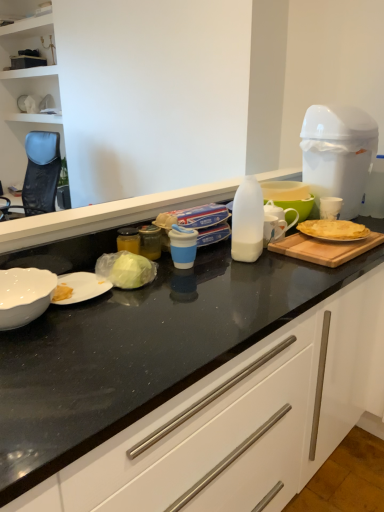
Question: Is the surface of translucent plastic milk bottle at center in direct contact with wooden cutting board at right?

Choices:
 (A) yes
 (B) no

Answer: (B)

Question: Is translucent plastic milk bottle at center positioned with its back to wooden cutting board at right?

Choices:
 (A) yes
 (B) no

Answer: (B)

Question: Is translucent plastic milk bottle at center positioned beyond the bounds of wooden cutting board at right?

Choices:
 (A) no
 (B) yes

Answer: (B)

Question: Is translucent plastic milk bottle at center thinner than wooden cutting board at right?

Choices:
 (A) yes
 (B) no

Answer: (A)

Question: Does translucent plastic milk bottle at center have a smaller size compared to wooden cutting board at right?

Choices:
 (A) yes
 (B) no

Answer: (B)

Question: Visually, is translucent plastic milk bottle at center positioned to the left or to the right of white glossy bowl at lower left?

Choices:
 (A) right
 (B) left

Answer: (A)

Question: From the image's perspective, is translucent plastic milk bottle at center positioned above or below white glossy bowl at lower left?

Choices:
 (A) above
 (B) below

Answer: (A)

Question: Is point (1, 242) positioned closer to the camera than point (36, 283)?

Choices:
 (A) farther
 (B) closer

Answer: (A)

Question: Is translucent plastic milk bottle at center inside or outside of white glossy bowl at lower left?

Choices:
 (A) inside
 (B) outside

Answer: (B)

Question: Is translucent plastic milk bottle at center inside or outside of white plastic trash can at upper right?

Choices:
 (A) outside
 (B) inside

Answer: (A)

Question: Is point (69, 218) closer or farther from the camera than point (316, 105)?

Choices:
 (A) closer
 (B) farther

Answer: (A)

Question: Would you say translucent plastic milk bottle at center is to the left or to the right of white plastic trash can at upper right in the picture?

Choices:
 (A) right
 (B) left

Answer: (B)

Question: From a real-world perspective, is translucent plastic milk bottle at center positioned above or below white plastic trash can at upper right?

Choices:
 (A) above
 (B) below

Answer: (B)

Question: Is white plastic trash can at upper right wider or thinner than golden crispy crepe at right?

Choices:
 (A) thin
 (B) wide

Answer: (B)

Question: In terms of size, does white plastic trash can at upper right appear bigger or smaller than golden crispy crepe at right?

Choices:
 (A) big
 (B) small

Answer: (A)